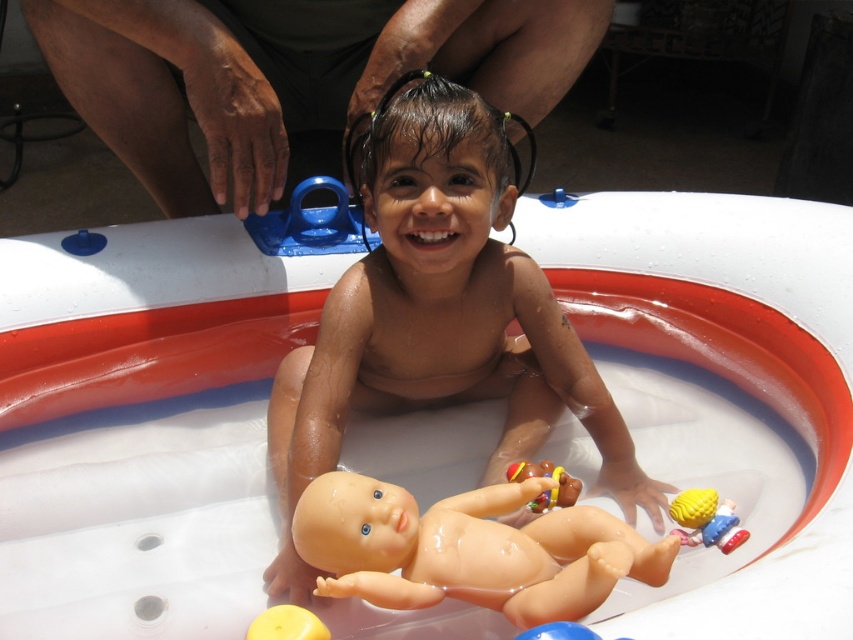
Based on the scene description, can you determine which object is taller between the white rubber bath at center and the brown skin at upper center?

The white rubber bath at center is taller than the brown skin at upper center according to the description.

You are a parent looking at the image of your child in the inflatable pool. You want to know if the white rubber bath at center is positioned below the brown skin at upper center. Can you confirm this?

Yes, the white rubber bath at center is positioned below the brown skin at upper center as described.

You are a photographer trying to capture the perfect shot of the scene. The white rubber bath at center is at point 0.391, 0.836. If you want to frame the bath exactly in the center of your photo, should you move your camera to the left or right?

The white rubber bath at center is already positioned at point (712, 250), which is the center of the image. Therefore, no adjustment is needed to frame it in the center.